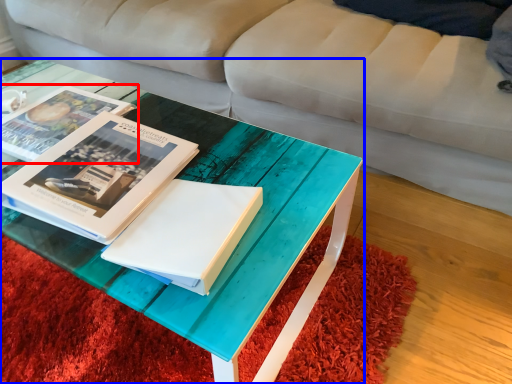
Question: Which object is closer to the camera taking this photo, book (highlighted by a red box) or coffee table (highlighted by a blue box)?

Choices:
 (A) book
 (B) coffee table

Answer: (B)